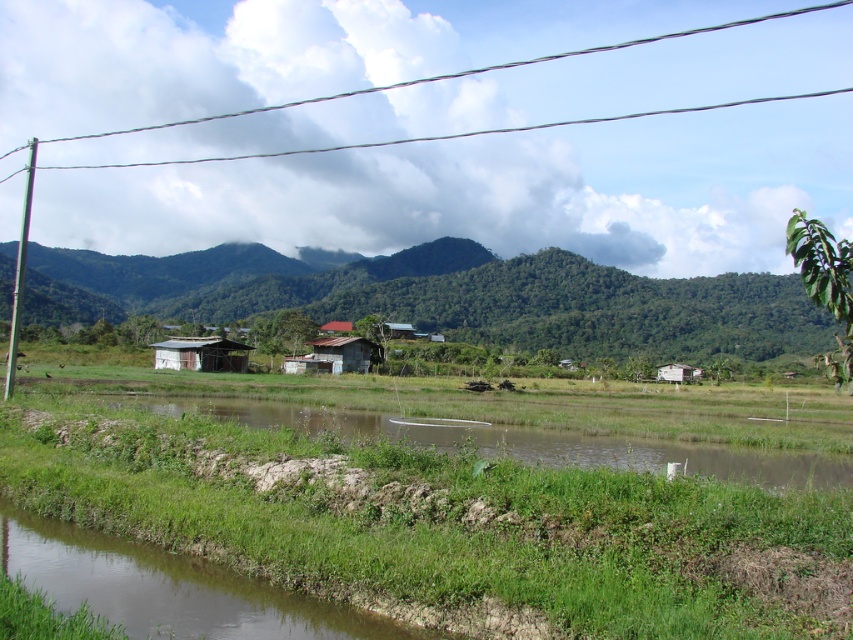
Question: Considering the relative positions of metallic wire at upper center and white wooden hut at center in the image provided, where is metallic wire at upper center located with respect to white wooden hut at center?

Choices:
 (A) above
 (B) below

Answer: (A)

Question: Does rusty corrugated hut at center have a smaller size compared to white wooden hut at center?

Choices:
 (A) no
 (B) yes

Answer: (A)

Question: Which point is closer to the camera?

Choices:
 (A) click(231, 355)
 (B) click(453, 76)

Answer: (A)

Question: Is green grassy river at lower center further to camera compared to white wooden hut at center?

Choices:
 (A) yes
 (B) no

Answer: (B)

Question: Which point appears farthest from the camera in this image?

Choices:
 (A) (747, 285)
 (B) (354, 349)
 (C) (679, 369)

Answer: (A)

Question: Which is farther from the metallic wire at upper center?

Choices:
 (A) green forested mountain at left
 (B) green grassy river at lower center

Answer: (B)